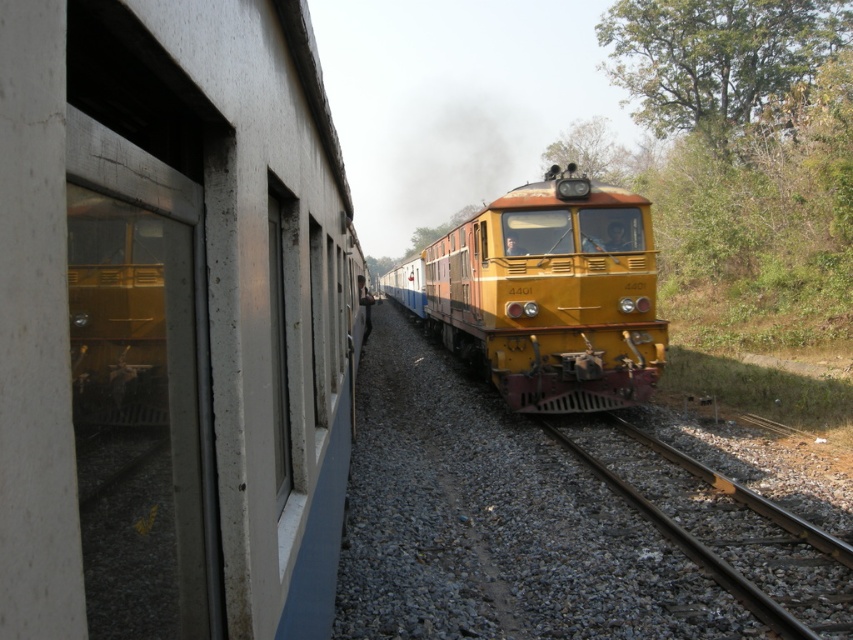
You are standing at the point labeled as point (720, 531) in the image. What is the material of the surface you are standing on?

The point (720, 531) corresponds to smooth metal train track at center, so the surface you are standing on is made of smooth metal.

You are a passenger on the yellow metallic train at center and want to see the green leafy tree at upper right. Which direction should you look to see the tree from your current position?

The yellow metallic train at center is positioned on the left side of the green leafy tree at upper right, so you should look to your right to see the tree.